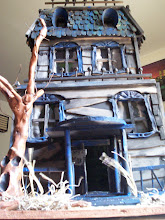
Where is `frame`? Image resolution: width=165 pixels, height=220 pixels. frame is located at coordinates (47, 97), (124, 91).